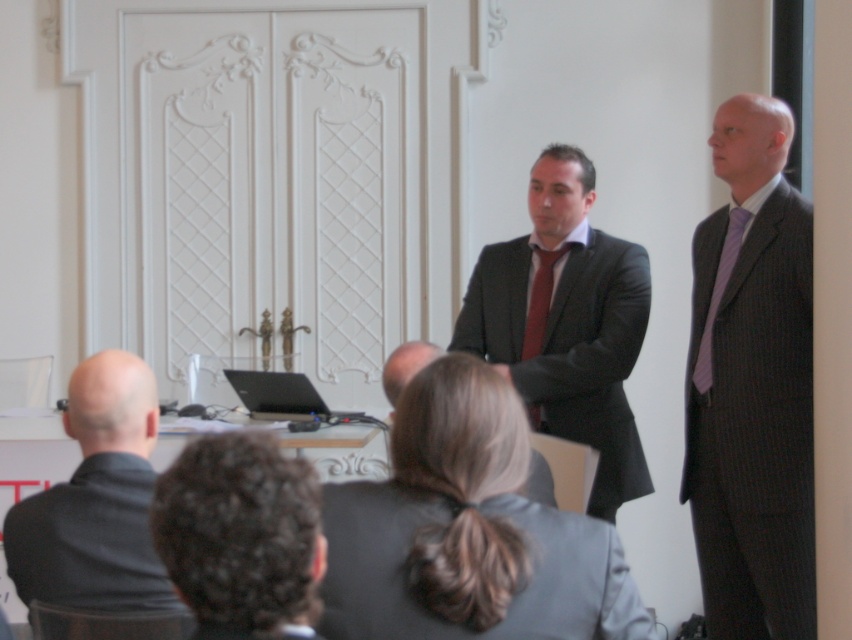
Which is behind, point (429, 353) or point (543, 323)?

Positioned behind is point (543, 323).

What do you see at coordinates (406, 369) in the screenshot? This screenshot has height=640, width=852. I see `dark gray suit at center` at bounding box center [406, 369].

Find the location of a particular element. dark gray suit at center is located at coordinates (406, 369).

Which of these two, gray fabric jacket at center or curly hair at lower left, stands taller?

gray fabric jacket at center

Who is lower down, gray fabric jacket at center or curly hair at lower left?

curly hair at lower left

Locate an element on the screen. This screenshot has height=640, width=852. gray fabric jacket at center is located at coordinates (467, 531).

Which of these two, matte black suit at center or purple silk tie at right, stands taller?

With more height is matte black suit at center.

Image resolution: width=852 pixels, height=640 pixels. What do you see at coordinates (566, 323) in the screenshot? I see `matte black suit at center` at bounding box center [566, 323].

Which is behind, point (608, 392) or point (734, 220)?

Positioned behind is point (608, 392).

You are a GUI agent. You are given a task and a screenshot of the screen. Output one action in this format:
    pyautogui.click(x=<x>, y=<y>)
    Task: Click on the matte black suit at center
    The height and width of the screenshot is (640, 852).
    Given the screenshot: What is the action you would take?
    pyautogui.click(x=566, y=323)